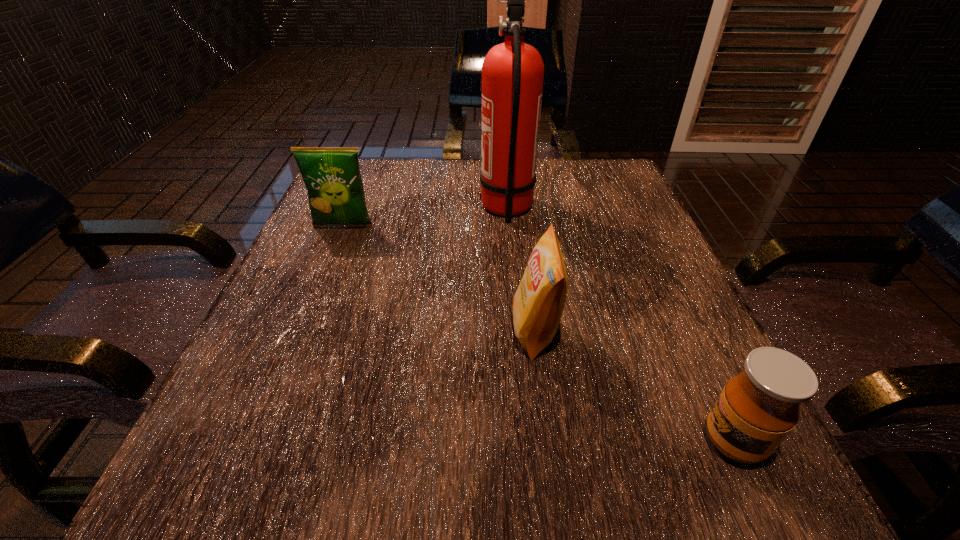
Locate an element on the screen. Image resolution: width=960 pixels, height=540 pixels. free area in between the tallest object and the nearest object is located at coordinates (620, 325).

Locate an element on the screen. vacant area that lies between the farther crisp (potato chip) and the fire extinguisher is located at coordinates (425, 217).

You are a GUI agent. You are given a task and a screenshot of the screen. Output one action in this format:
    pyautogui.click(x=<x>, y=<y>)
    Task: Click on the vacant space that is in between the leftmost object and the tallest object
    This screenshot has width=960, height=540.
    Given the screenshot: What is the action you would take?
    pyautogui.click(x=425, y=217)

The height and width of the screenshot is (540, 960). Identify the location of free space between the shortest object and the fire extinguisher. (620, 325).

The image size is (960, 540). What are the coordinates of `free spot between the left crisp (potato chip) and the fire extinguisher` in the screenshot? It's located at click(425, 217).

The height and width of the screenshot is (540, 960). In order to click on free space between the leftmost object and the fire extinguisher in this screenshot , I will do `click(425, 217)`.

This screenshot has width=960, height=540. I want to click on vacant area that lies between the second nearest object and the honey, so click(x=635, y=386).

You are a GUI agent. You are given a task and a screenshot of the screen. Output one action in this format:
    pyautogui.click(x=<x>, y=<y>)
    Task: Click on the third closest object relative to the honey
    The image size is (960, 540).
    Given the screenshot: What is the action you would take?
    pyautogui.click(x=332, y=177)

In order to click on object that is the closest to the tallest object in this screenshot , I will do `click(538, 303)`.

Image resolution: width=960 pixels, height=540 pixels. In order to click on free space that satisfies the following two spatial constraints: 1. on the handle side of the fire extinguisher; 2. on the front-facing side of the left crisp (potato chip) in this screenshot , I will do `click(509, 226)`.